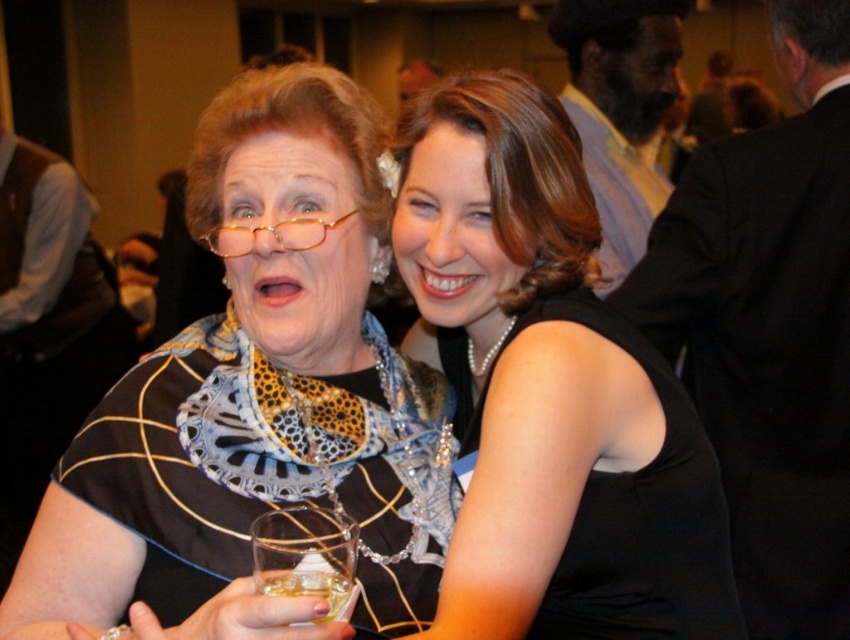
Question: Can you confirm if matte black dress at center is positioned to the left of clear glass at center?

Choices:
 (A) yes
 (B) no

Answer: (A)

Question: Which point appears farthest from the camera in this image?

Choices:
 (A) (276, 250)
 (B) (574, 483)

Answer: (A)

Question: Which is nearer to the matte black dress at center?

Choices:
 (A) clear glass at center
 (B) translucent glass at lower center

Answer: (A)

Question: Can you confirm if matte black dress at center is positioned to the left of translucent glass at lower center?

Choices:
 (A) yes
 (B) no

Answer: (A)

Question: Can you confirm if clear glass at center is thinner than translucent glass at lower center?

Choices:
 (A) no
 (B) yes

Answer: (A)

Question: Which point appears closest to the camera in this image?

Choices:
 (A) (632, 365)
 (B) (296, 589)

Answer: (B)